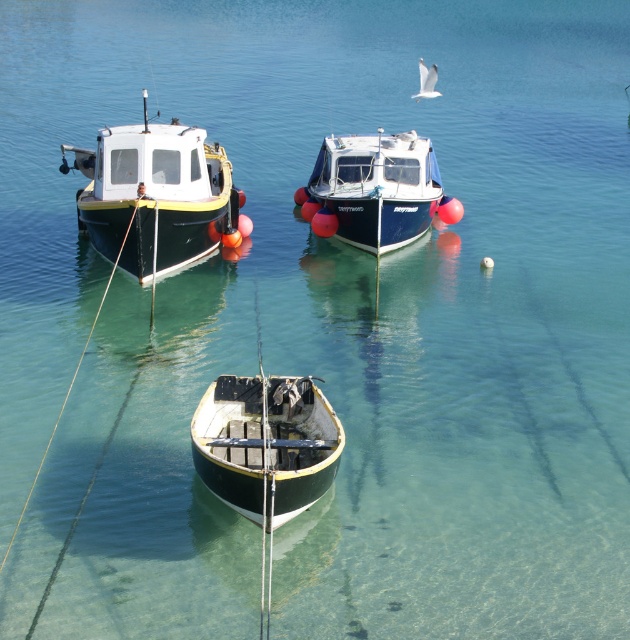
You are standing at the edge of the water and want to reach the green matte boat at center. According to the coordinates provided, in which direction should you move relative to your current position?

The green matte boat at center is located at coordinates point (265, 444). Since you are at the edge of the water, you should move towards the center of the water to reach it.

You are a photographer positioned at the edge of the water, aiming to capture a clear shot of the green matte boat at center without the blue glossy boat at center obstructing the view. Based on their positions, is this possible?

The green matte boat at center is in front of the blue glossy boat at center, so it will block the view of the blue glossy boat at center. Therefore, you can capture a clear shot of the green matte boat at center without the blue glossy boat at center obstructing the view.

Based on the photo, you are planning to load cargo onto the matte black boat at left and the green matte boat at center. Based on their sizes, which boat can carry more cargo?

The matte black boat at left can carry more cargo because its width is larger than the green matte boat at center.